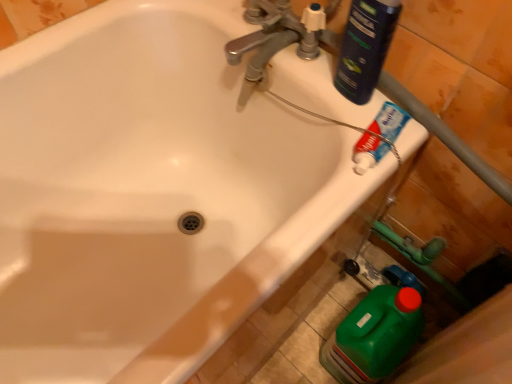
Question: From the image's perspective, is white glossy toothpaste at upper right above or below green plastic container at lower right, which is the 2th cleaning product in top-to-bottom order?

Choices:
 (A) above
 (B) below

Answer: (A)

Question: From a real-world perspective, is white glossy toothpaste at upper right above or below green plastic container at lower right, which is counted as the first cleaning product, starting from the bottom?

Choices:
 (A) above
 (B) below

Answer: (A)

Question: Considering the real-world distances, which object is farthest from the green plastic container at lower right, placed as the 2th cleaning product when sorted from front to back?

Choices:
 (A) dark blue plastic bottle at upper right, the second cleaning product positioned from the bottom
 (B) silver metallic faucet at upper center
 (C) white glossy toothpaste at upper right

Answer: (B)

Question: Estimate the real-world distances between objects in this image. Which object is closer to the dark blue plastic bottle at upper right, which appears as the first cleaning product when viewed from the front?

Choices:
 (A) green plastic container at lower right, which is counted as the first cleaning product, starting from the bottom
 (B) silver metallic faucet at upper center
 (C) white glossy toothpaste at upper right

Answer: (C)